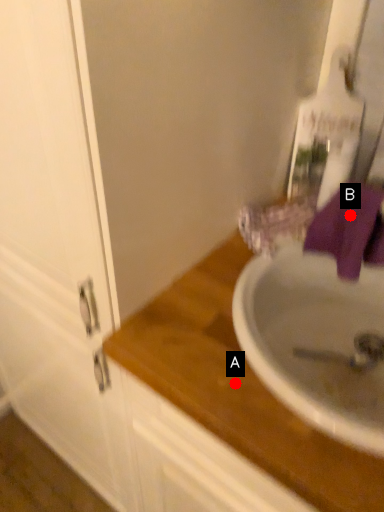
Question: Two points are circled on the image, labeled by A and B beside each circle. Which point appears closest to the camera in this image?

Choices:
 (A) A is closer
 (B) B is closer

Answer: (A)